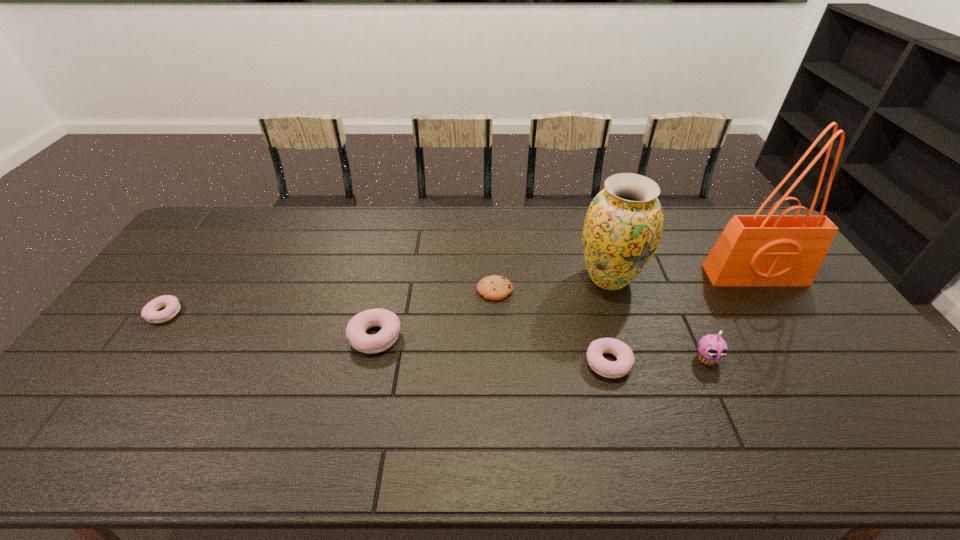
Please point out where to position a new doughnut on the right to maintain spacing. Please provide its 2D coordinates. Your answer should be formatted as a tuple, i.e. [(x, y)], where the tuple contains the x and y coordinates of a point satisfying the conditions above.

[(869, 392)]